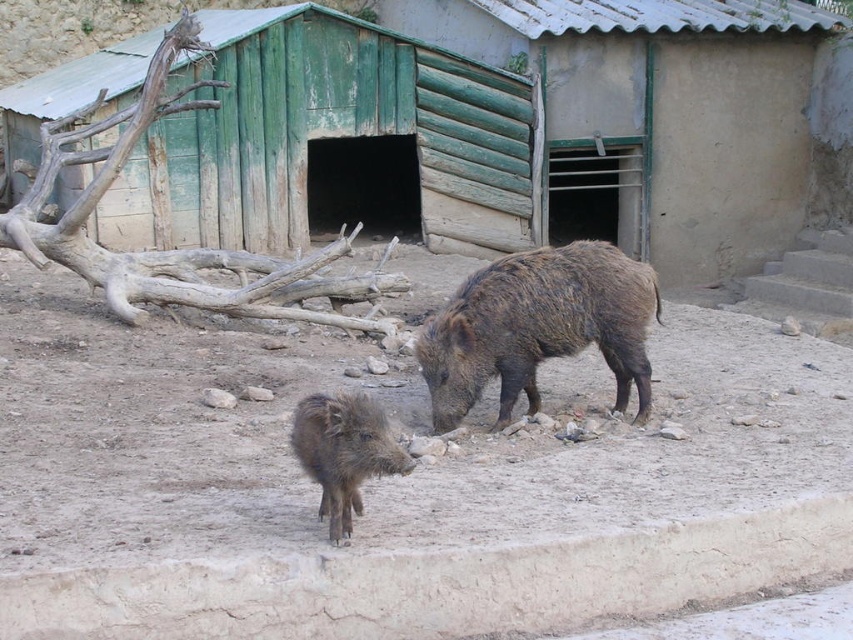
Question: Can you confirm if brown rough textured pig at center is positioned above brown fuzzy piglet at center?

Choices:
 (A) no
 (B) yes

Answer: (B)

Question: Where is brown rough textured pig at center located in relation to brown fuzzy piglet at center in the image?

Choices:
 (A) left
 (B) right

Answer: (B)

Question: Which object is the farthest from the brown rough textured pig at center?

Choices:
 (A) brown sandy dirt at center
 (B) brown fuzzy piglet at center

Answer: (B)

Question: Which object appears farthest from the camera in this image?

Choices:
 (A) brown rough textured pig at center
 (B) brown sandy dirt at center
 (C) brown fuzzy piglet at center

Answer: (A)

Question: Estimate the real-world distances between objects in this image. Which object is closer to the brown sandy dirt at center?

Choices:
 (A) brown rough textured pig at center
 (B) brown fuzzy piglet at center

Answer: (B)

Question: Does brown sandy dirt at center have a smaller size compared to brown rough textured pig at center?

Choices:
 (A) yes
 (B) no

Answer: (A)